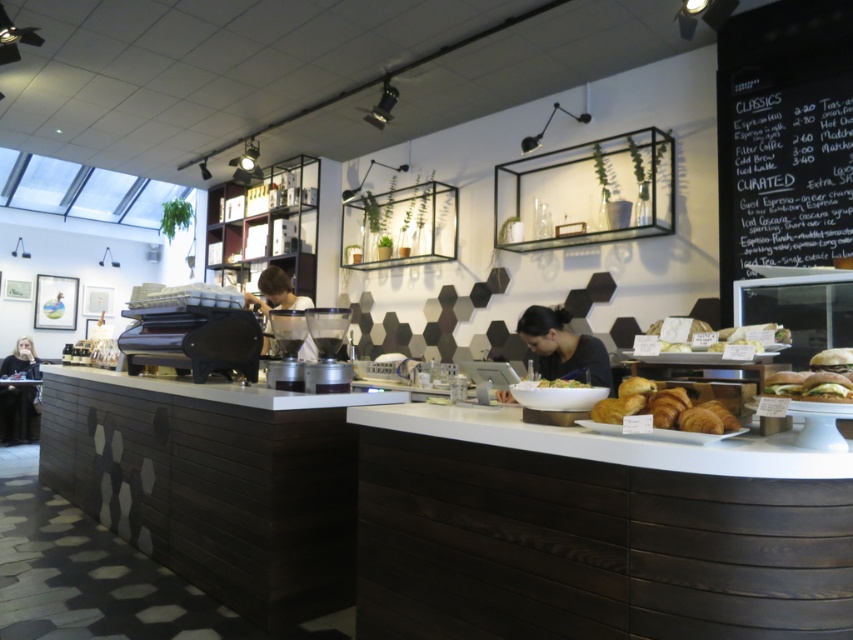
You are a customer at the modern cafe and want to place your order using the matte black laptop at center. However, you notice the golden brown croissant at center is blocking your access to the laptop. Based on the scene description, can you determine if the laptop is accessible for use?

The matte black laptop at center is below the golden brown croissant at center, so the laptop is positioned under the croissant and might be obstructed. You may need to move the croissant to access the laptop.

Based on the photo, you are a customer trying to place an order at the modern cafe. You see a matte black laptop at center and a matte black coffee machine at center. Which object is closer to you if you are standing in front of the counter?

The matte black laptop at center is closer to you because it is positioned under the matte black coffee machine at center, meaning it is in front of the coffee machine and thus nearer to your position in front of the counter.